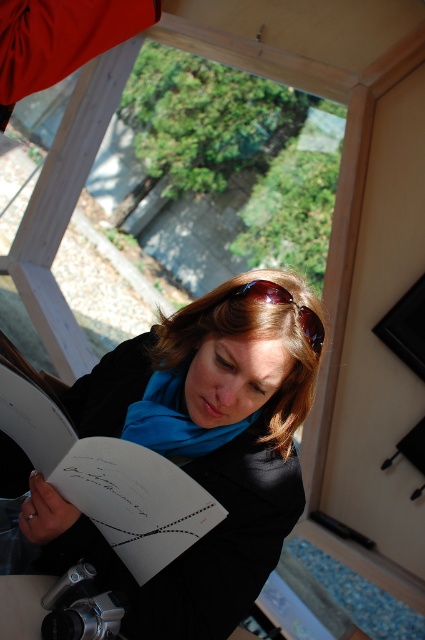
In the scene shown: You are a photographer trying to capture a closeup shot of the brown leather sunglasses at center. However, the blue fabric scarf at center is blocking your view. Can you still take the photo without moving the scarf?

The blue fabric scarf at center is further to the viewer than brown leather sunglasses at center, so the scarf is closer to you and blocking the sunglasses. You cannot take the photo without moving the scarf.

You are standing in the room and want to determine which of the two points, point (286, 289) or point (257, 284), is closer to you. Based on the scene description, which point is nearer?

Point (286, 289) is further to the viewer than point (257, 284). Therefore, point (257, 284) is closer to you.

You are a tailor who needs to store the black matte jacket at center and the brown leather sunglasses at center in a rectangular box. The box has a width of 30 cm. Can both items fit side by side in the box without overlapping?

The black matte jacket at center might be wider than brown leather sunglasses at center, so it is uncertain if both can fit side by side in the 30 cm wide box. Measure the jacket and sunglasses to confirm their combined width.